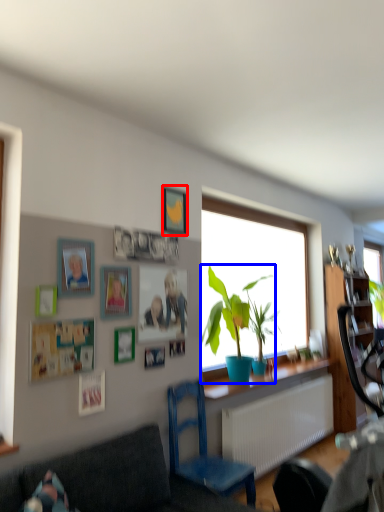
Question: Which point is further to the camera, picture frame (highlighted by a red box) or houseplant (highlighted by a blue box)?

Choices:
 (A) picture frame
 (B) houseplant

Answer: (B)